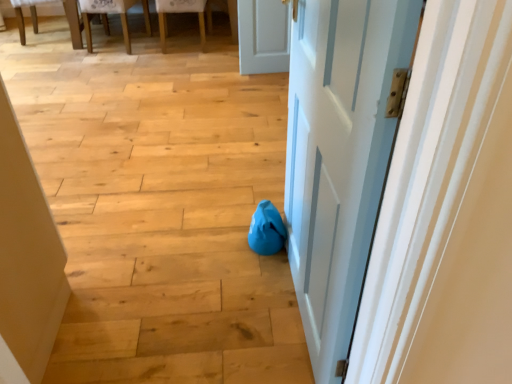
Identify the location of vacant space that's between white painted wood door at center and blue fabric bean bag at center. This screenshot has height=384, width=512. (273, 294).